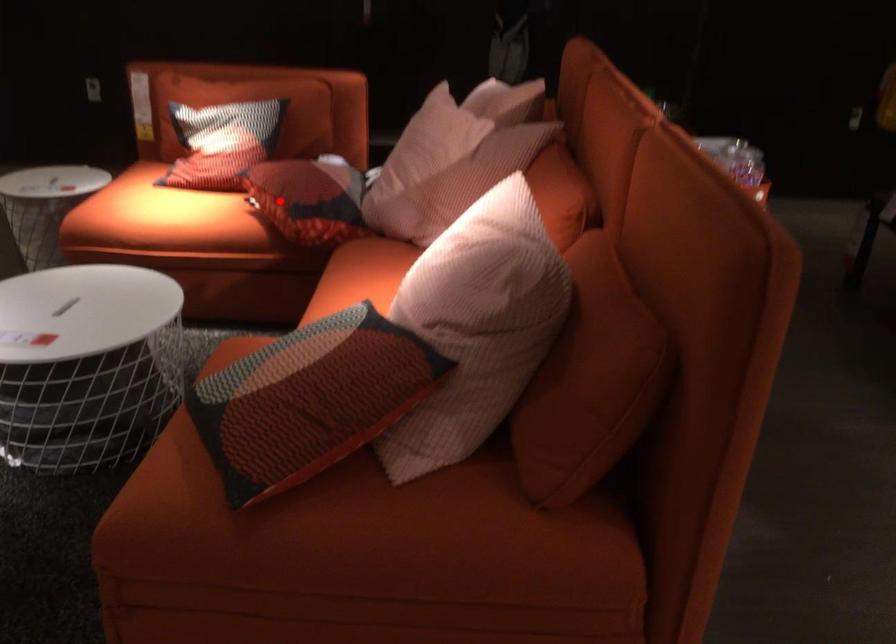
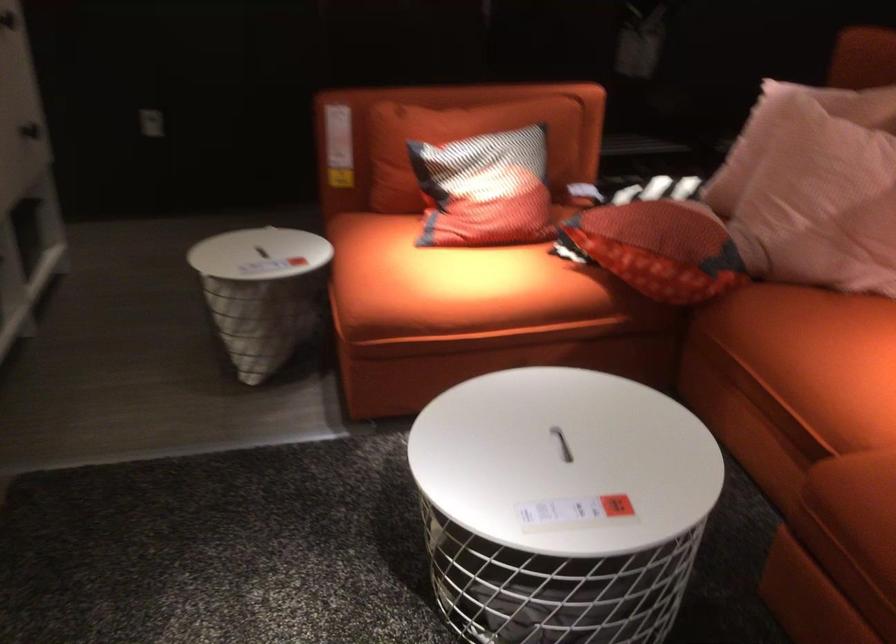
Question: I am providing you with two images of the same scene from different viewpoints. In image1, a red point is highlighted. Considering the same 3D point in image2, which of the following is correct?

Choices:
 (A) It is closer
 (B) It is farther

Answer: (A)